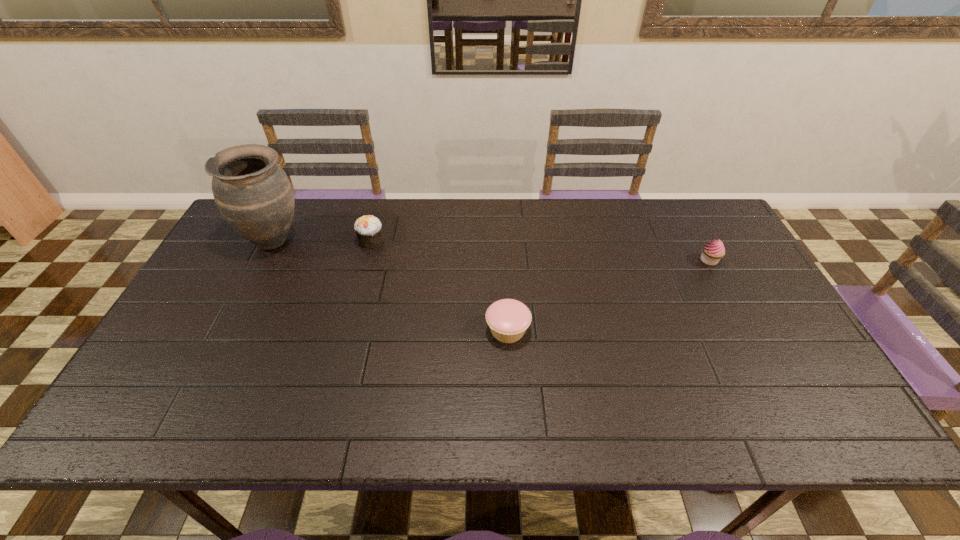
This screenshot has width=960, height=540. In order to click on urn in this screenshot , I will do `click(253, 193)`.

Where is `the tallest object`? The height and width of the screenshot is (540, 960). the tallest object is located at coordinates (253, 193).

Locate an element on the screen. Image resolution: width=960 pixels, height=540 pixels. the rightmost object is located at coordinates (712, 252).

The width and height of the screenshot is (960, 540). I want to click on the rightmost cupcake, so click(x=712, y=252).

The width and height of the screenshot is (960, 540). In order to click on the leftmost cupcake in this screenshot , I will do `click(368, 228)`.

Identify the location of the farthest cupcake. (368, 228).

Where is `the second cupcake from right to left`? This screenshot has width=960, height=540. the second cupcake from right to left is located at coordinates (508, 319).

This screenshot has height=540, width=960. Find the location of `the nearest cupcake`. the nearest cupcake is located at coordinates (508, 319).

I want to click on blank area located 0.250m on the front of the leftmost object, so click(229, 328).

The width and height of the screenshot is (960, 540). In order to click on vacant area situated on the right of the second farthest cupcake in this screenshot , I will do `click(736, 260)`.